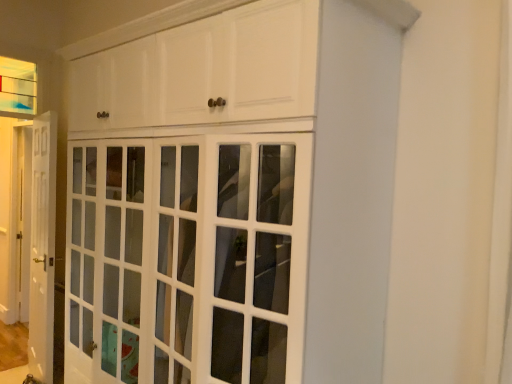
Question: Can you confirm if white glossy door at left is smaller than white glossy cabinet at center?

Choices:
 (A) yes
 (B) no

Answer: (A)

Question: Is white glossy door at left wider than white glossy cabinet at center?

Choices:
 (A) no
 (B) yes

Answer: (A)

Question: Can you confirm if white glossy door at left is positioned to the left of white glossy cabinet at center?

Choices:
 (A) no
 (B) yes

Answer: (B)

Question: Does white glossy door at left have a larger size compared to white glossy cabinet at center?

Choices:
 (A) yes
 (B) no

Answer: (B)

Question: Is white glossy door at left shorter than white glossy cabinet at center?

Choices:
 (A) yes
 (B) no

Answer: (B)

Question: From a real-world perspective, relative to white glossy door at left, is clear glass window at upper left vertically above or below?

Choices:
 (A) above
 (B) below

Answer: (A)

Question: Is clear glass window at upper left situated inside white glossy door at left or outside?

Choices:
 (A) outside
 (B) inside

Answer: (A)

Question: Considering the positions of clear glass window at upper left and white glossy door at left in the image, is clear glass window at upper left wider or thinner than white glossy door at left?

Choices:
 (A) wide
 (B) thin

Answer: (B)

Question: Based on their sizes in the image, would you say clear glass window at upper left is bigger or smaller than white glossy door at left?

Choices:
 (A) big
 (B) small

Answer: (B)

Question: Looking at the image, does white glossy cabinet at center seem bigger or smaller compared to white glossy door at left?

Choices:
 (A) small
 (B) big

Answer: (B)

Question: From a real-world perspective, is white glossy cabinet at center above or below white glossy door at left?

Choices:
 (A) below
 (B) above

Answer: (B)

Question: Which is correct: white glossy cabinet at center is inside white glossy door at left, or outside of it?

Choices:
 (A) outside
 (B) inside

Answer: (A)

Question: Is white glossy cabinet at center taller or shorter than white glossy door at left?

Choices:
 (A) short
 (B) tall

Answer: (A)

Question: From a real-world perspective, is white glossy door at left physically located above or below white glossy cabinet at center?

Choices:
 (A) below
 (B) above

Answer: (A)

Question: From their relative heights in the image, would you say white glossy door at left is taller or shorter than white glossy cabinet at center?

Choices:
 (A) short
 (B) tall

Answer: (B)